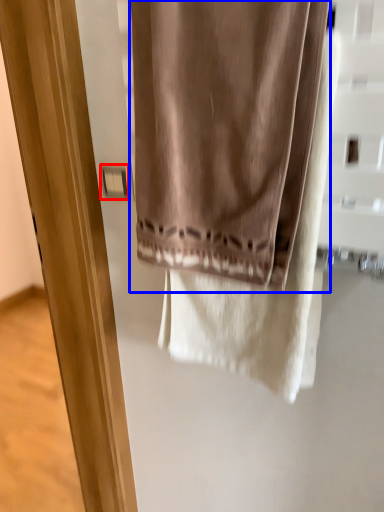
Question: Among these objects, which one is farthest to the camera, light switch (highlighted by a red box) or curtain (highlighted by a blue box)?

Choices:
 (A) light switch
 (B) curtain

Answer: (A)